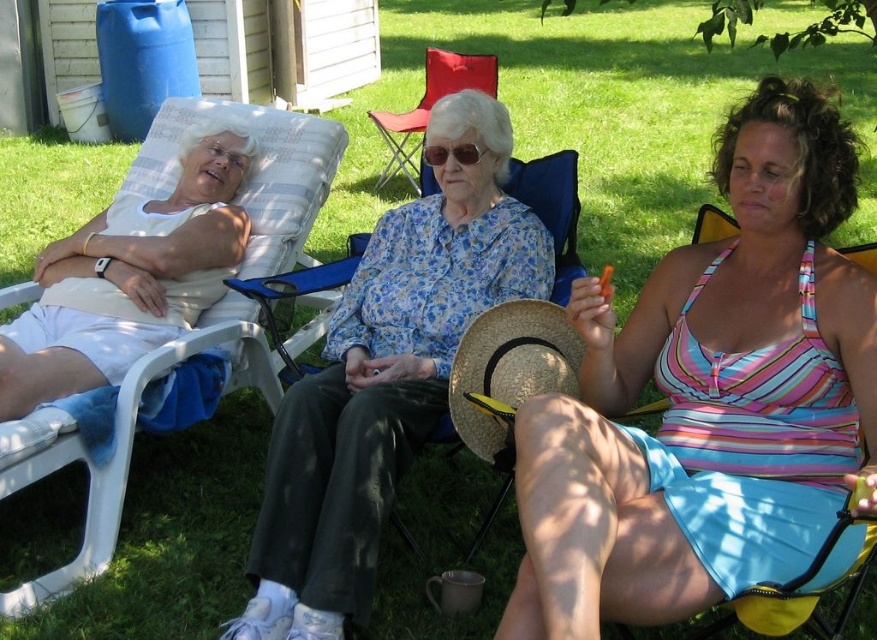
You are a photographer trying to capture a candid shot of the striped fabric tank top at center and the red fabric folding chair at center. To ensure both are in frame, you need to know their relative positions. Which object is located to the right of the other?

The striped fabric tank top at center is positioned on the right side of the red fabric folding chair at center, so the striped fabric tank top at center is to the right of the red fabric folding chair at center.

You are a fashion designer observing two women in the image. The first woman is wearing a striped fabric tank top at center, and the second is wearing a floral fabric blouse at center. From the perspective of someone standing in front of them, which clothing item is located to the left?

The floral fabric blouse at center is located to the left of the striped fabric tank top at center.

Based on the scene description, which clothing item is positioned lower on the person wearing it, the striped fabric tank top at center or the floral fabric blouse at center?

The striped fabric tank top at center is positioned lower than the floral fabric blouse at center.